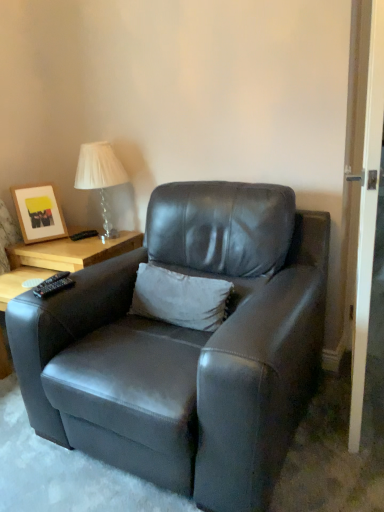
Question: Is white soft pillow at center surrounded by matte wooden picture frame at upper left?

Choices:
 (A) no
 (B) yes

Answer: (A)

Question: Can you confirm if matte wooden picture frame at upper left is taller than white soft pillow at center?

Choices:
 (A) yes
 (B) no

Answer: (A)

Question: Can you confirm if matte wooden picture frame at upper left is thinner than white soft pillow at center?

Choices:
 (A) no
 (B) yes

Answer: (A)

Question: Could you tell me if matte wooden picture frame at upper left is facing white soft pillow at center?

Choices:
 (A) yes
 (B) no

Answer: (A)

Question: Can you confirm if matte wooden picture frame at upper left is smaller than white soft pillow at center?

Choices:
 (A) no
 (B) yes

Answer: (B)

Question: From the image's perspective, is matte wooden picture frame at upper left under white soft pillow at center?

Choices:
 (A) no
 (B) yes

Answer: (A)

Question: Is clear glass table lamp at upper left positioned with its back to matte black armchair at center?

Choices:
 (A) no
 (B) yes

Answer: (A)

Question: Does clear glass table lamp at upper left have a greater width compared to matte black armchair at center?

Choices:
 (A) no
 (B) yes

Answer: (A)

Question: Does clear glass table lamp at upper left have a smaller size compared to matte black armchair at center?

Choices:
 (A) no
 (B) yes

Answer: (B)

Question: Is clear glass table lamp at upper left thinner than matte black armchair at center?

Choices:
 (A) no
 (B) yes

Answer: (B)

Question: Is clear glass table lamp at upper left next to matte black armchair at center and touching it?

Choices:
 (A) yes
 (B) no

Answer: (B)

Question: Is clear glass table lamp at upper left further to the viewer compared to matte black armchair at center?

Choices:
 (A) no
 (B) yes

Answer: (B)

Question: From a real-world perspective, is white wood screen door at right beneath matte wooden picture frame at upper left?

Choices:
 (A) no
 (B) yes

Answer: (A)